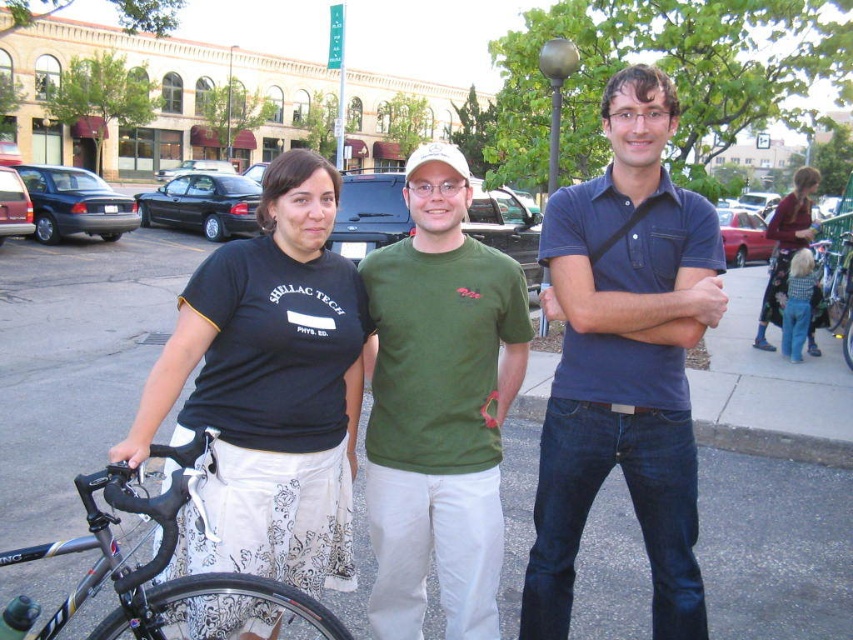
Between point (224, 362) and point (158, 564), which one is positioned behind?

Point (224, 362)

Who is higher up, black cotton shirt at center or shiny black bicycle at lower left?

black cotton shirt at center is higher up.

This screenshot has width=853, height=640. Describe the element at coordinates (268, 388) in the screenshot. I see `black cotton shirt at center` at that location.

Where is `black cotton shirt at center`? This screenshot has width=853, height=640. black cotton shirt at center is located at coordinates (268, 388).

Which is behind, point (612, 288) or point (802, 209)?

Positioned behind is point (802, 209).

Is blue cotton polo shirt at center further to camera compared to floral skirt at right?

That is False.

Find the location of a particular element. Image resolution: width=853 pixels, height=640 pixels. blue cotton polo shirt at center is located at coordinates (625, 360).

Is blue cotton polo shirt at center taller than shiny black bicycle at lower left?

Correct, blue cotton polo shirt at center is much taller as shiny black bicycle at lower left.

The width and height of the screenshot is (853, 640). In order to click on blue cotton polo shirt at center in this screenshot , I will do `click(625, 360)`.